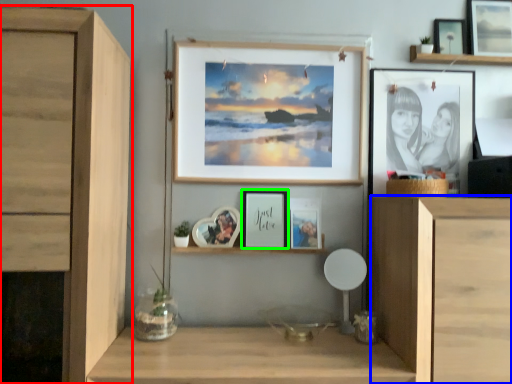
Question: Which object is the closest to the cabinetry (highlighted by a red box)? Choose among these: cabinetry (highlighted by a blue box) or picture frame (highlighted by a green box).

Choices:
 (A) cabinetry
 (B) picture frame

Answer: (B)